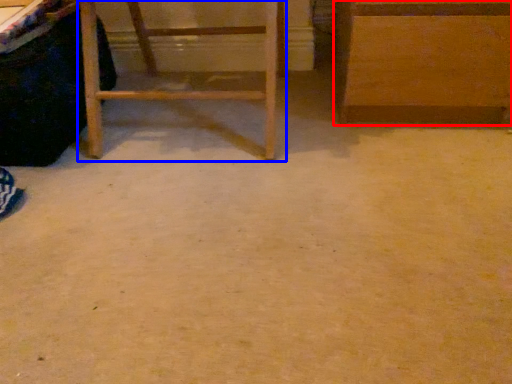
Question: Which point is closer to the camera, furniture (highlighted by a red box) or furniture (highlighted by a blue box)?

Choices:
 (A) furniture
 (B) furniture

Answer: (B)